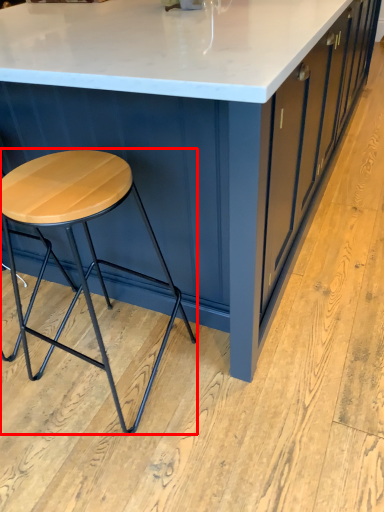
Question: Considering the relative positions of stool (annotated by the red box) and table in the image provided, where is stool (annotated by the red box) located with respect to the staircase?

Choices:
 (A) right
 (B) left

Answer: (B)